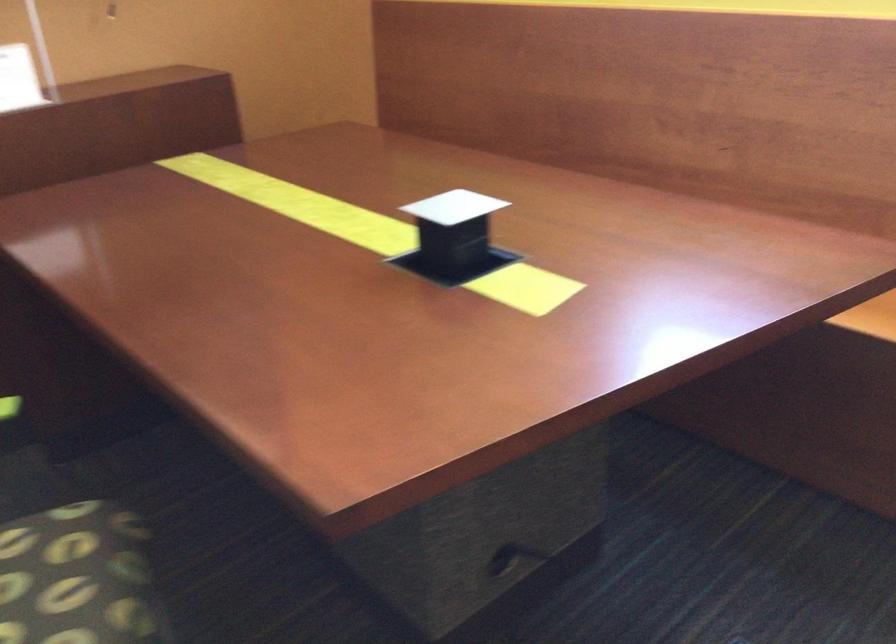
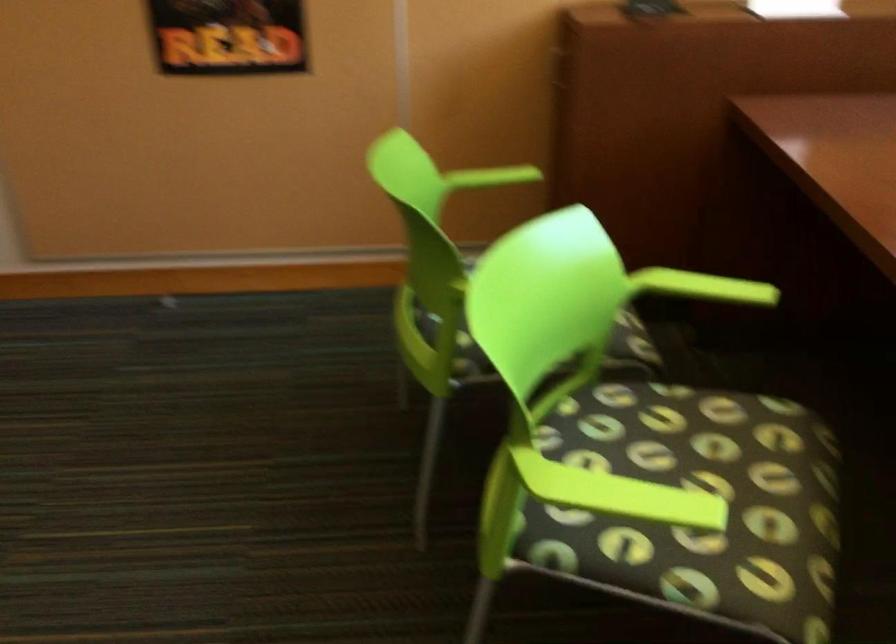
Question: The camera is either moving clockwise (left) or counter-clockwise (right) around the object. The first image is from the beginning of the video and the second image is from the end. Is the camera moving left or right when shooting the video?

Choices:
 (A) Left
 (B) Right

Answer: (B)